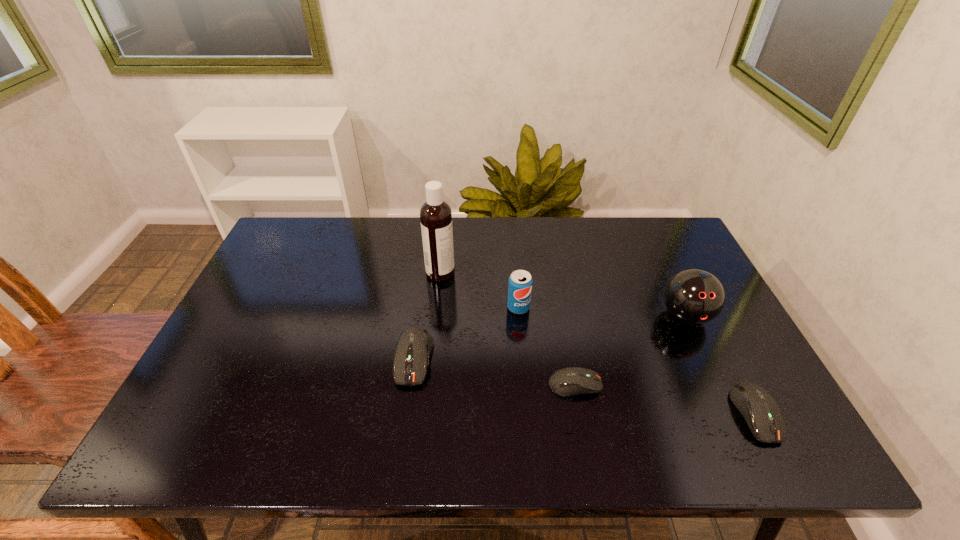
Where is `the leftmost computer equipment`? the leftmost computer equipment is located at coordinates (413, 347).

This screenshot has width=960, height=540. I want to click on the second computer equipment from left to right, so click(570, 381).

This screenshot has width=960, height=540. Identify the location of the shortest computer equipment. pos(570,381).

Where is `the second shortest computer equipment`? The width and height of the screenshot is (960, 540). the second shortest computer equipment is located at coordinates (759, 409).

The image size is (960, 540). I want to click on the rightmost computer equipment, so point(759,409).

You are a GUI agent. You are given a task and a screenshot of the screen. Output one action in this format:
    pyautogui.click(x=<x>, y=<y>)
    Task: Click on the third tallest object
    This screenshot has height=540, width=960.
    Given the screenshot: What is the action you would take?
    pyautogui.click(x=520, y=281)

This screenshot has width=960, height=540. I want to click on the third object from left to right, so click(520, 281).

Identify the location of the farthest object. (435, 214).

Find the location of a particular element. The height and width of the screenshot is (540, 960). the tallest object is located at coordinates (435, 214).

Find the location of a particular element. Image resolution: width=960 pixels, height=540 pixels. bowling ball is located at coordinates (693, 296).